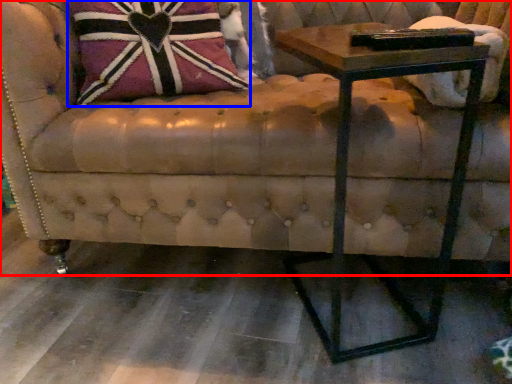
Question: Which object is closer to the camera taking this photo, studio couch (highlighted by a red box) or throw pillow (highlighted by a blue box)?

Choices:
 (A) studio couch
 (B) throw pillow

Answer: (A)